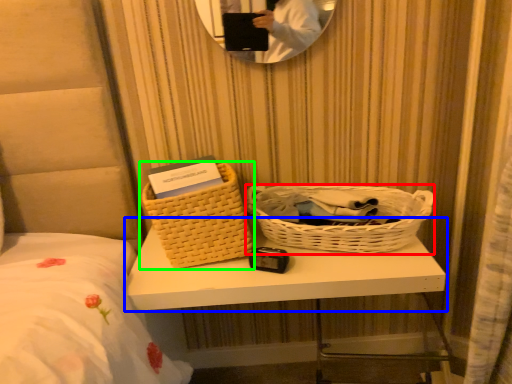
Question: Considering the real-world distances, which object is farthest from picnic basket (highlighted by a red box)? table (highlighted by a blue box) or picnic basket (highlighted by a green box)?

Choices:
 (A) table
 (B) picnic basket

Answer: (B)